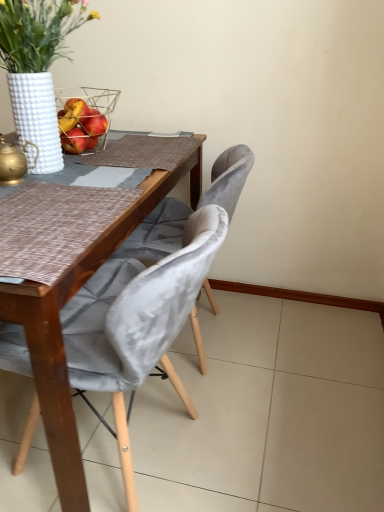
Question: Does white textured vase at upper left lie in front of velvet grey chair at center, placed as the 2th chair when sorted from back to front?

Choices:
 (A) yes
 (B) no

Answer: (B)

Question: Is white textured vase at upper left looking in the opposite direction of velvet grey chair at center, acting as the first chair starting from the front?

Choices:
 (A) yes
 (B) no

Answer: (B)

Question: Can you confirm if white textured vase at upper left is wider than velvet grey chair at center, placed as the 2th chair when sorted from back to front?

Choices:
 (A) no
 (B) yes

Answer: (A)

Question: Would you say white textured vase at upper left is a long distance from velvet grey chair at center, acting as the first chair starting from the front?

Choices:
 (A) no
 (B) yes

Answer: (A)

Question: Is white textured vase at upper left positioned beyond the bounds of velvet grey chair at center, acting as the first chair starting from the front?

Choices:
 (A) no
 (B) yes

Answer: (B)

Question: From the image's perspective, would you say white textured vase at upper left is shown under velvet grey chair at center, acting as the first chair starting from the front?

Choices:
 (A) yes
 (B) no

Answer: (B)

Question: Considering the relative sizes of white textured vase at upper left and velvet grey chair at center, the 2th chair positioned from the front, in the image provided, is white textured vase at upper left smaller than velvet grey chair at center, the 2th chair positioned from the front,?

Choices:
 (A) no
 (B) yes

Answer: (B)

Question: From the image's perspective, is white textured vase at upper left over velvet grey chair at center, the 2th chair positioned from the front?

Choices:
 (A) yes
 (B) no

Answer: (A)

Question: Considering the relative sizes of white textured vase at upper left and velvet grey chair at center, acting as the 1th chair starting from the back, in the image provided, is white textured vase at upper left thinner than velvet grey chair at center, acting as the 1th chair starting from the back,?

Choices:
 (A) no
 (B) yes

Answer: (B)

Question: Is white textured vase at upper left positioned before velvet grey chair at center, the 2th chair positioned from the front?

Choices:
 (A) no
 (B) yes

Answer: (B)

Question: Is white textured vase at upper left looking in the opposite direction of velvet grey chair at center, the 2th chair positioned from the front?

Choices:
 (A) no
 (B) yes

Answer: (A)

Question: Is white textured vase at upper left not inside velvet grey chair at center, acting as the 1th chair starting from the back?

Choices:
 (A) no
 (B) yes

Answer: (B)

Question: From the image's perspective, would you say velvet grey chair at center, acting as the 1th chair starting from the back, is shown under white textured vase at upper left?

Choices:
 (A) yes
 (B) no

Answer: (A)